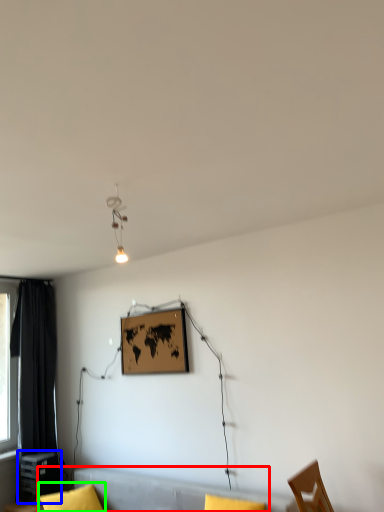
Question: Estimate the real-world distances between objects in this image. Which object is closer to couch (highlighted by a red box), table (highlighted by a blue box) or pillow (highlighted by a green box)?

Choices:
 (A) table
 (B) pillow

Answer: (B)